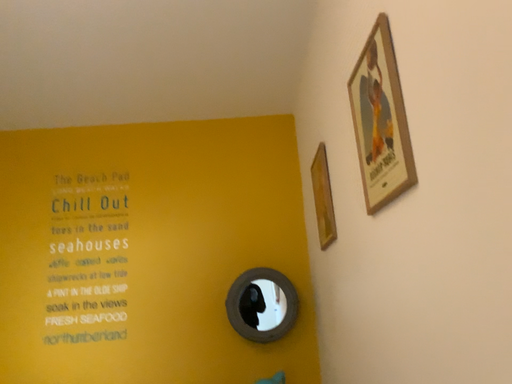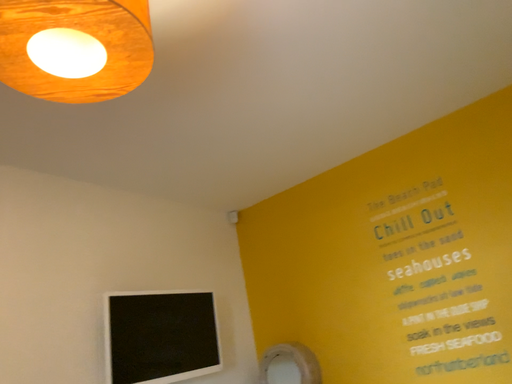
Question: How did the camera likely rotate when shooting the video?

Choices:
 (A) rotated right
 (B) rotated left

Answer: (B)